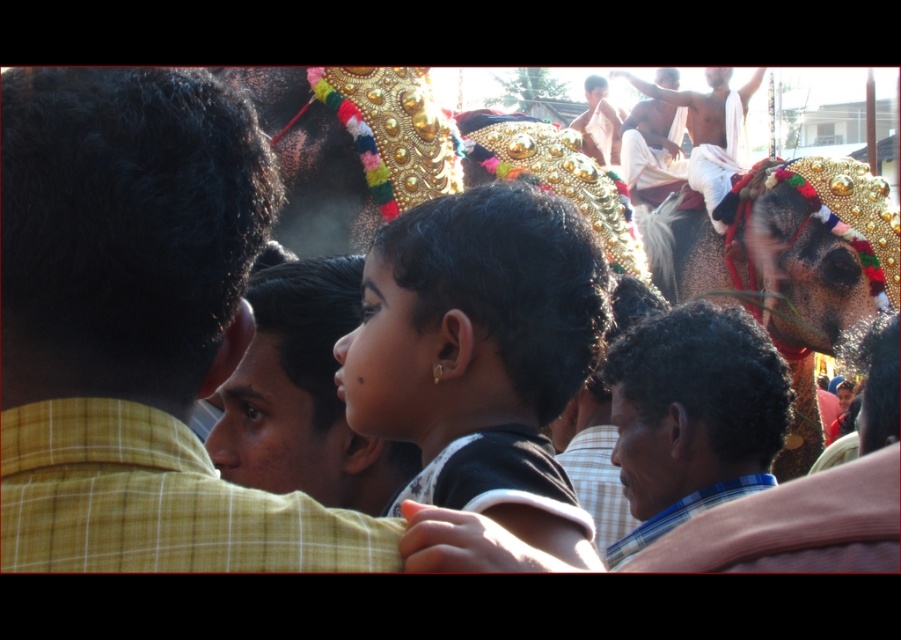
Question: Does yellow plaid shirt at left have a smaller size compared to light brown skin at upper center?

Choices:
 (A) yes
 (B) no

Answer: (A)

Question: Where is black matte hair at center located in relation to shiny gold ornament at upper right in the image?

Choices:
 (A) right
 (B) left

Answer: (B)

Question: Which object is the closest to the dark skin man at upper right?

Choices:
 (A) dark brown curly hair at center
 (B) light brown plaid shirt at center
 (C) shiny gold ornament at upper right

Answer: (C)

Question: From the image, what is the correct spatial relationship of black matte hair at center in relation to shiny gold ornament at upper right?

Choices:
 (A) below
 (B) above

Answer: (A)

Question: Among these points, which one is nearest to the camera?

Choices:
 (A) (26, 74)
 (B) (669, 484)

Answer: (A)

Question: Which point is farther from the camera taking this photo?

Choices:
 (A) (712, 424)
 (B) (693, 156)
 (C) (631, 195)
 (D) (595, 136)

Answer: (D)